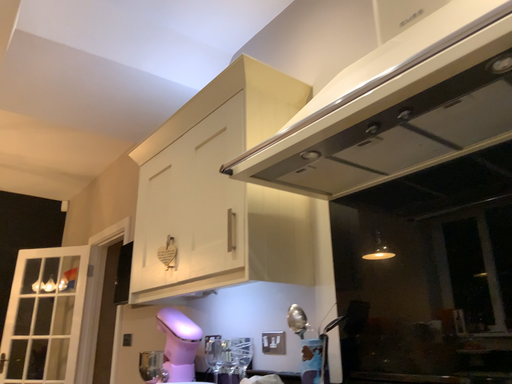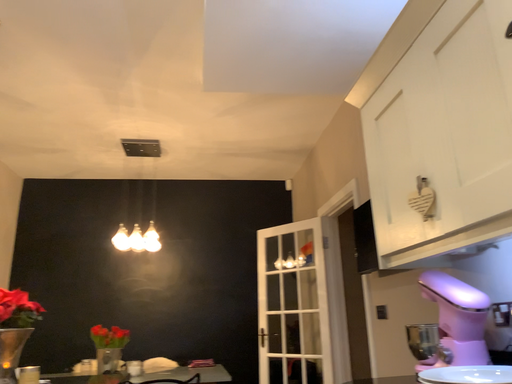
Question: Which way did the camera rotate in the video?

Choices:
 (A) rotated right
 (B) rotated left

Answer: (B)